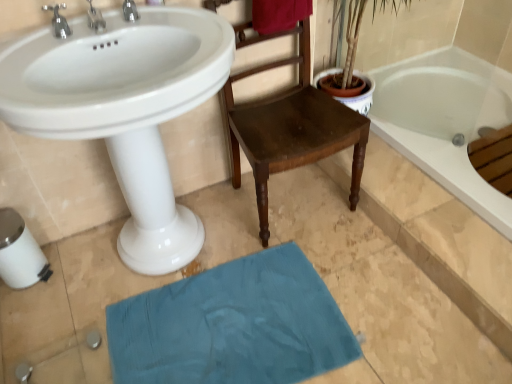
Identify the location of vacant area located to the right-hand side of silver metallic tap at upper left, which is counted as the 3th tap, starting from the left. The image size is (512, 384). (177, 25).